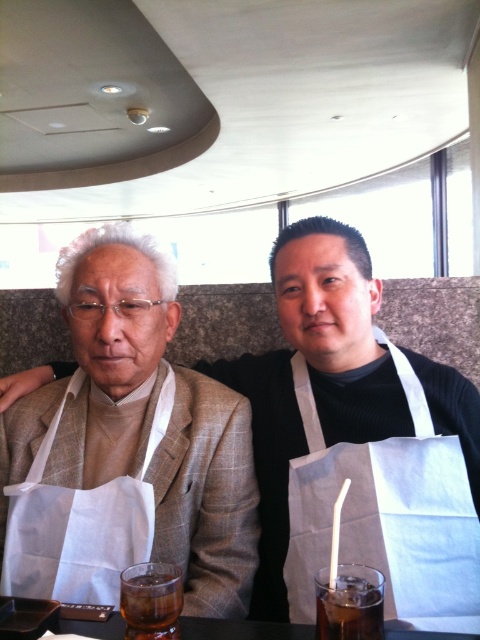
Question: Which point is closer to the camera taking this photo?

Choices:
 (A) (423, 493)
 (B) (232, 438)

Answer: (A)

Question: Based on their relative distances, which object is farther from the white textured apron at left?

Choices:
 (A) dark brown glass at lower center
 (B) white fabric paper bag at center
 (C) brown translucent glass at lower center

Answer: (A)

Question: Does white textured apron at left appear under brown translucent glass at lower center?

Choices:
 (A) yes
 (B) no

Answer: (B)

Question: Is white textured apron at left bigger than brown translucent glass at lower center?

Choices:
 (A) no
 (B) yes

Answer: (B)

Question: Considering the relative positions of white fabric paper bag at center and brown translucent glass at lower center in the image provided, where is white fabric paper bag at center located with respect to brown translucent glass at lower center?

Choices:
 (A) below
 (B) above

Answer: (B)

Question: Which point appears closest to the camera in this image?

Choices:
 (A) (419, 440)
 (B) (315, 582)
 (C) (95, 378)

Answer: (B)